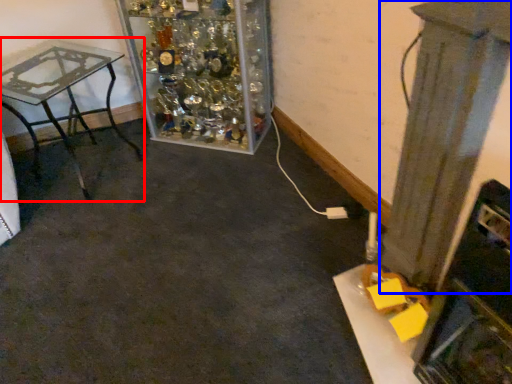
Question: Among these objects, which one is farthest to the camera, table (highlighted by a red box) or pillar (highlighted by a blue box)?

Choices:
 (A) table
 (B) pillar

Answer: (A)